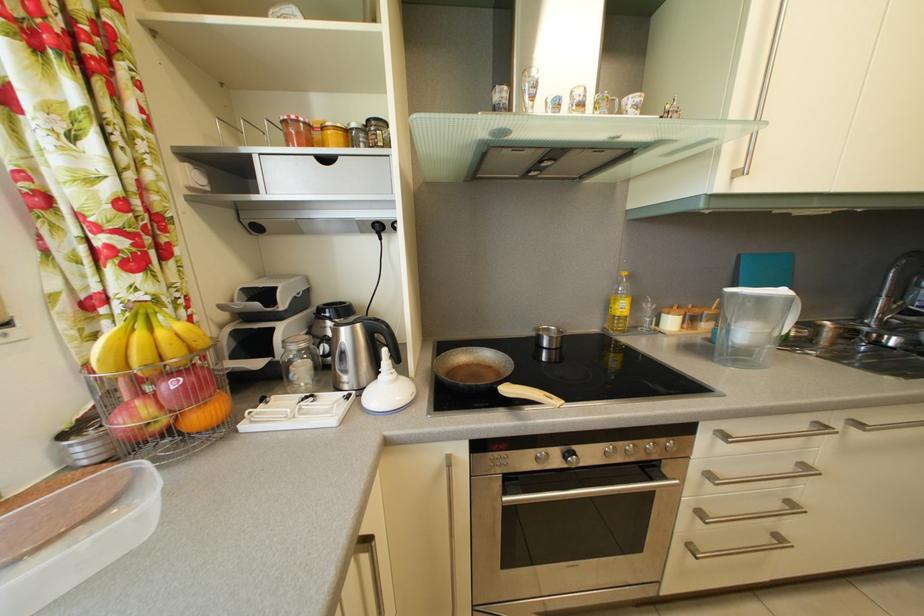
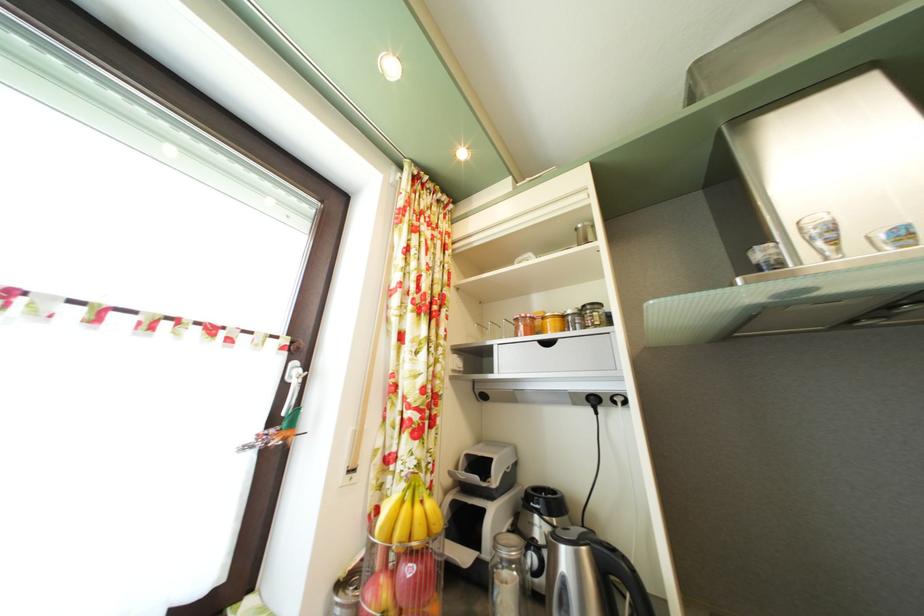
Where in the second image is the point corresponding to the point at 568,107 from the first image?

(917, 235)